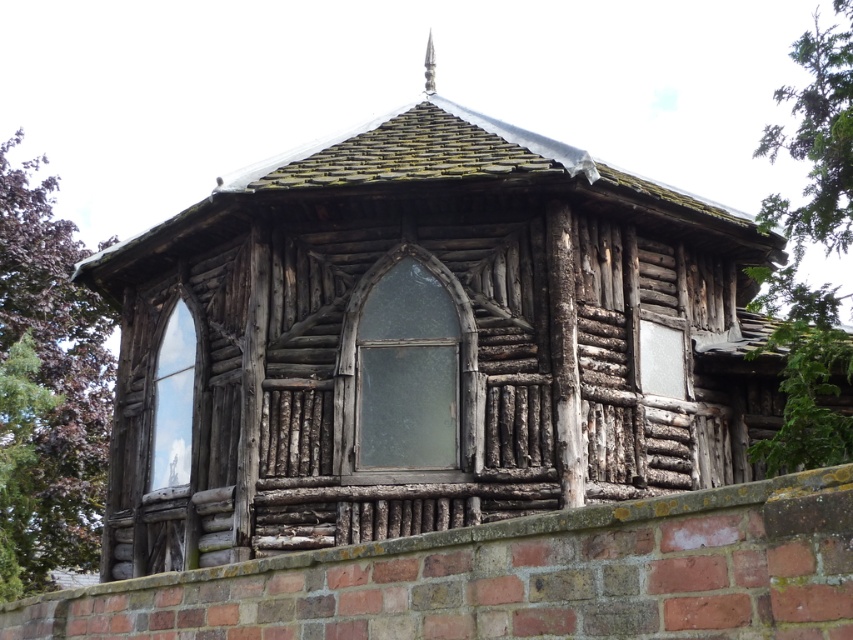
Looking at this image, you are standing in front of the rustic wooden structure and want to know what is located at the coordinates point (x=804, y=252). What is there?

At point (x=804, y=252) lies green leafy tree at upper right.

Based on the scene description, which tree has a smaller width between the purple leafy tree at left and the green leafy tree at upper right?

The purple leafy tree at left has a smaller width compared to the green leafy tree at upper right.

From the picture: What is the spatial relationship between the purple leafy tree at left and the translucent glass window at center?

The purple leafy tree at left is positioned on the left side of the translucent glass window at center.